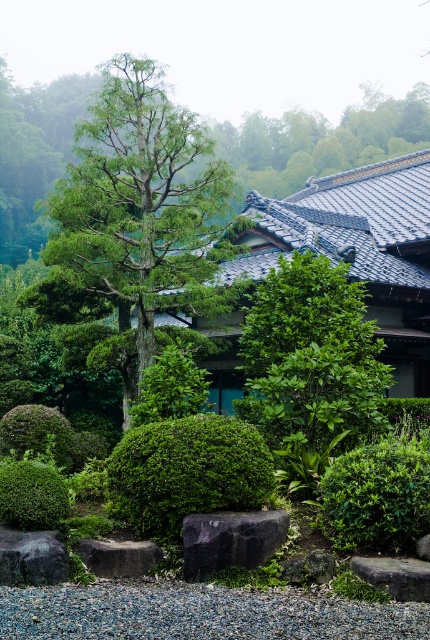
Question: Which point is farther to the camera?

Choices:
 (A) green mossy rock at lower left
 (B) gray rough stone at lower center
 (C) green textured tree at center
 (D) green leafy bush at lower right

Answer: (C)

Question: Among these points, which one is nearest to the camera?

Choices:
 (A) (107, 561)
 (B) (40, 484)
 (C) (245, 595)
 (D) (150, 275)

Answer: (C)

Question: Is green textured tree at center bigger than black smooth rock at lower left?

Choices:
 (A) yes
 (B) no

Answer: (A)

Question: Is purple polished stone at center further to the viewer compared to green mossy bush at lower left?

Choices:
 (A) yes
 (B) no

Answer: (B)

Question: Which of the following is the closest to the observer?

Choices:
 (A) gray gravel at lower center
 (B) gray rough stone at lower center
 (C) green mossy rock at lower left

Answer: (A)

Question: Is purple polished stone at center wider than green mossy rock at lower left?

Choices:
 (A) no
 (B) yes

Answer: (A)